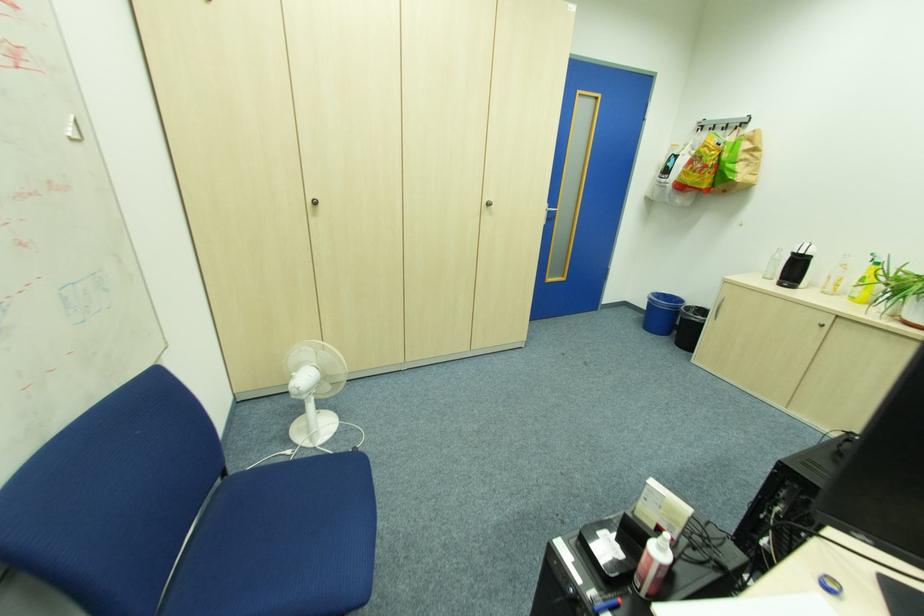
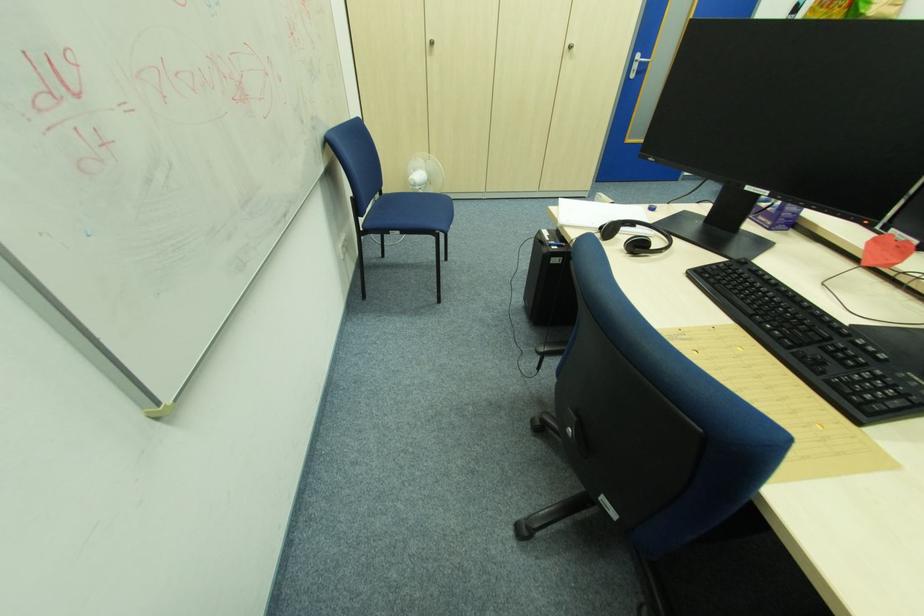
The point at (554, 209) is marked in the first image. Where is the corresponding point in the second image?

(647, 61)